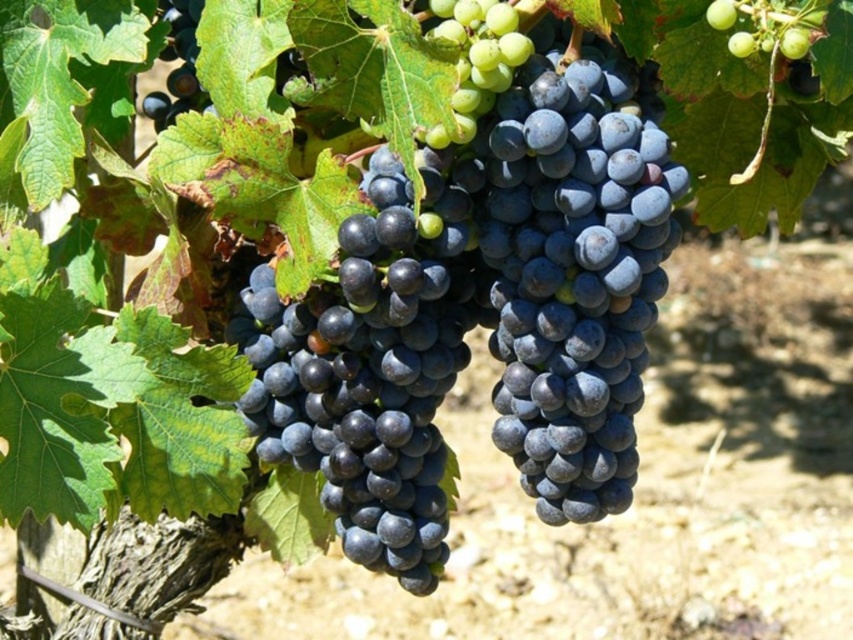
Does green matte grape at upper center have a smaller size compared to shiny dark blue grape at upper left?

Correct, green matte grape at upper center occupies less space than shiny dark blue grape at upper left.

Describe the element at coordinates (764, 26) in the screenshot. Image resolution: width=853 pixels, height=640 pixels. I see `green matte grape at upper center` at that location.

Locate an element on the screen. This screenshot has width=853, height=640. green matte grape at upper center is located at coordinates click(764, 26).

What do you see at coordinates (480, 298) in the screenshot? This screenshot has height=640, width=853. I see `shiny dark blue grapes at center` at bounding box center [480, 298].

Between shiny dark blue grapes at center and green matte grape at upper center, which one appears on the left side from the viewer's perspective?

From the viewer's perspective, shiny dark blue grapes at center appears more on the left side.

Is point (390, 538) less distant than point (730, 4)?

No, (390, 538) is further to viewer.

Find the location of a particular element. shiny dark blue grapes at center is located at coordinates (480, 298).

Which of these two, shiny dark blue grapes at center or shiny dark blue grape at upper left, stands taller?

Standing taller between the two is shiny dark blue grapes at center.

Can you confirm if shiny dark blue grapes at center is smaller than shiny dark blue grape at upper left?

Incorrect, shiny dark blue grapes at center is not smaller in size than shiny dark blue grape at upper left.

Who is more forward, (x=641, y=280) or (x=149, y=115)?

Point (x=641, y=280)

This screenshot has height=640, width=853. Identify the location of shiny dark blue grapes at center. (480, 298).